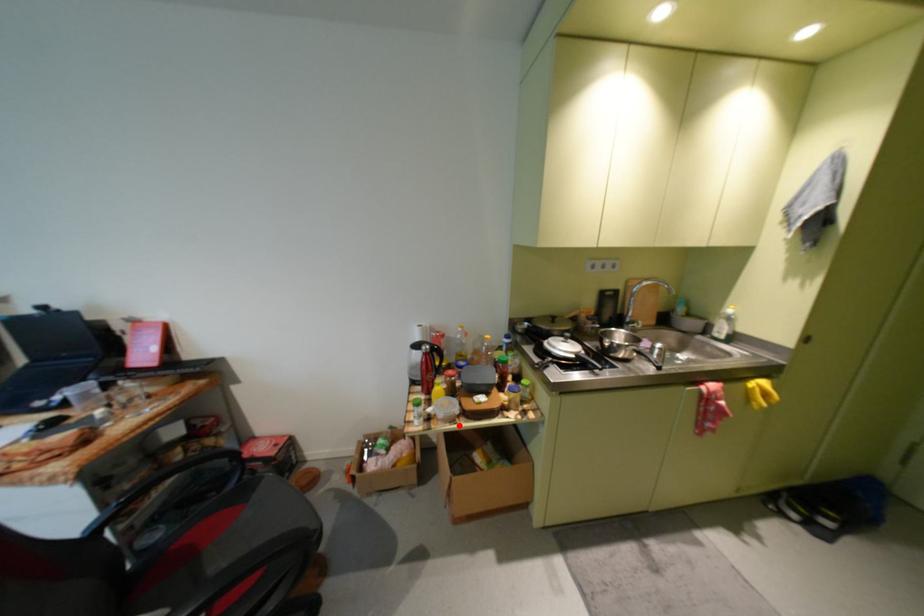
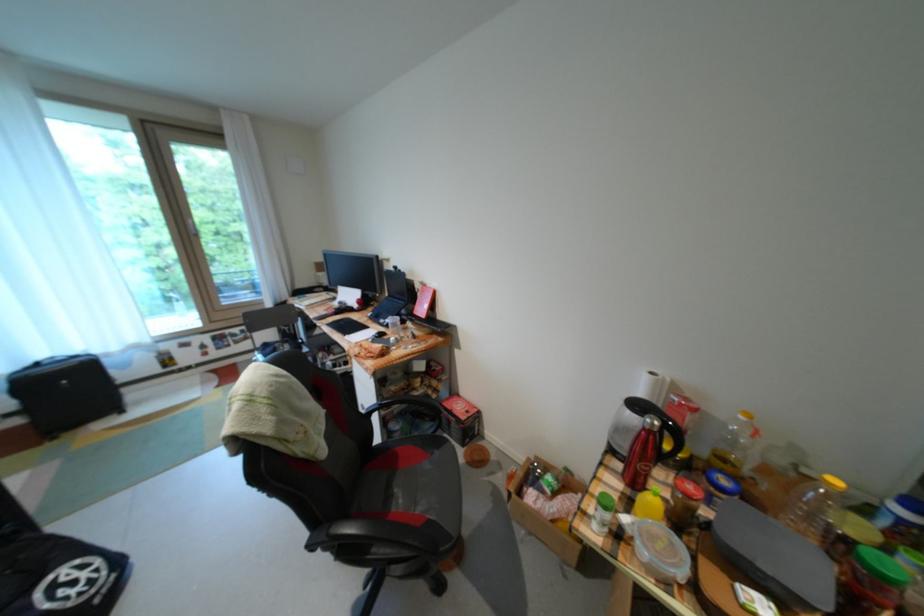
Find the pixel in the second image that matches the highlighted location in the first image.

(664, 582)